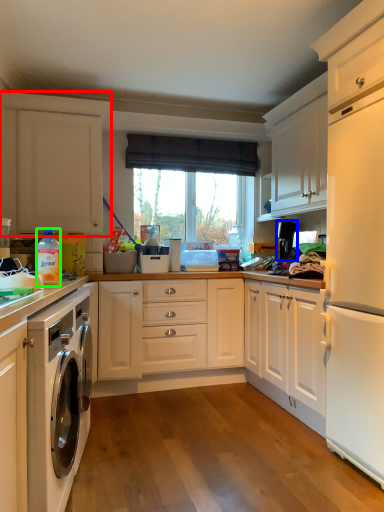
Question: Based on their relative distances, which object is nearer to cabinetry (highlighted by a red box)? Choose from appliance (highlighted by a blue box) and bottle (highlighted by a green box).

Choices:
 (A) appliance
 (B) bottle

Answer: (B)